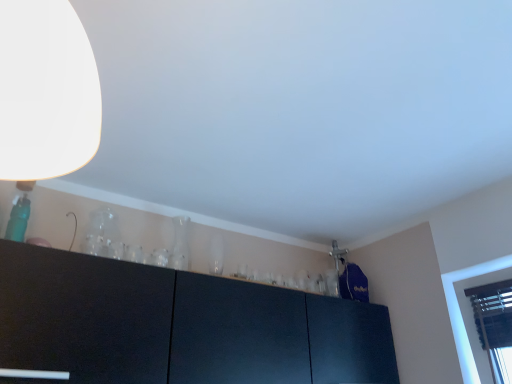
Question: Is transparent glass vase at center, the second glass vase from the left, taller than transparent glass vase at upper center, which is the 1th glass vase in front-to-back order?

Choices:
 (A) no
 (B) yes

Answer: (B)

Question: From the image's perspective, is transparent glass vase at center, marked as the 1th glass vase in a right-to-left arrangement, beneath transparent glass vase at upper center, acting as the second glass vase starting from the right?

Choices:
 (A) no
 (B) yes

Answer: (B)

Question: Can you see transparent glass vase at center, the 2th glass vase viewed from the front, touching transparent glass vase at upper center, which is the 1th glass vase in front-to-back order?

Choices:
 (A) no
 (B) yes

Answer: (A)

Question: Can you confirm if transparent glass vase at center, the second glass vase from the left, is positioned to the right of transparent glass vase at upper center, which is the 1th glass vase in front-to-back order?

Choices:
 (A) no
 (B) yes

Answer: (B)

Question: Can you confirm if transparent glass vase at center, the second glass vase from the left, is positioned to the left of transparent glass vase at upper center, positioned as the 1th glass vase in left-to-right order?

Choices:
 (A) yes
 (B) no

Answer: (B)

Question: Is point (180, 220) positioned closer to the camera than point (105, 225)?

Choices:
 (A) closer
 (B) farther

Answer: (B)

Question: Looking at their shapes, would you say transparent glass vase at center, positioned as the first glass vase in back-to-front order, is wider or thinner than transparent glass vase at upper center, positioned as the 1th glass vase in left-to-right order?

Choices:
 (A) wide
 (B) thin

Answer: (B)

Question: Looking at the image, does transparent glass vase at center, the 2th glass vase viewed from the front, seem bigger or smaller compared to transparent glass vase at upper center, the 2th glass vase in the back-to-front sequence?

Choices:
 (A) big
 (B) small

Answer: (A)

Question: From the image's perspective, is transparent glass vase at center, the second glass vase from the left, above or below transparent glass vase at upper center, positioned as the 1th glass vase in left-to-right order?

Choices:
 (A) above
 (B) below

Answer: (B)

Question: From the image's perspective, is transparent glass vase at upper center, the 2th glass vase in the back-to-front sequence, located above or below transparent glass vase at center, marked as the 1th glass vase in a right-to-left arrangement?

Choices:
 (A) above
 (B) below

Answer: (A)

Question: Based on their sizes in the image, would you say transparent glass vase at upper center, the 2th glass vase in the back-to-front sequence, is bigger or smaller than transparent glass vase at center, the second glass vase from the left?

Choices:
 (A) big
 (B) small

Answer: (B)

Question: Is transparent glass vase at upper center, the 2th glass vase in the back-to-front sequence, to the left or to the right of transparent glass vase at center, the 2th glass vase viewed from the front, in the image?

Choices:
 (A) right
 (B) left

Answer: (B)

Question: Relative to transparent glass vase at center, the second glass vase from the left, is transparent glass vase at upper center, acting as the second glass vase starting from the right, in front or behind?

Choices:
 (A) front
 (B) behind

Answer: (A)

Question: Is white matte lampshade at upper left bigger or smaller than transparent glass vase at upper center, the 2th glass vase in the back-to-front sequence?

Choices:
 (A) small
 (B) big

Answer: (B)

Question: Is white matte lampshade at upper left wider or thinner than transparent glass vase at upper center, positioned as the 1th glass vase in left-to-right order?

Choices:
 (A) wide
 (B) thin

Answer: (A)